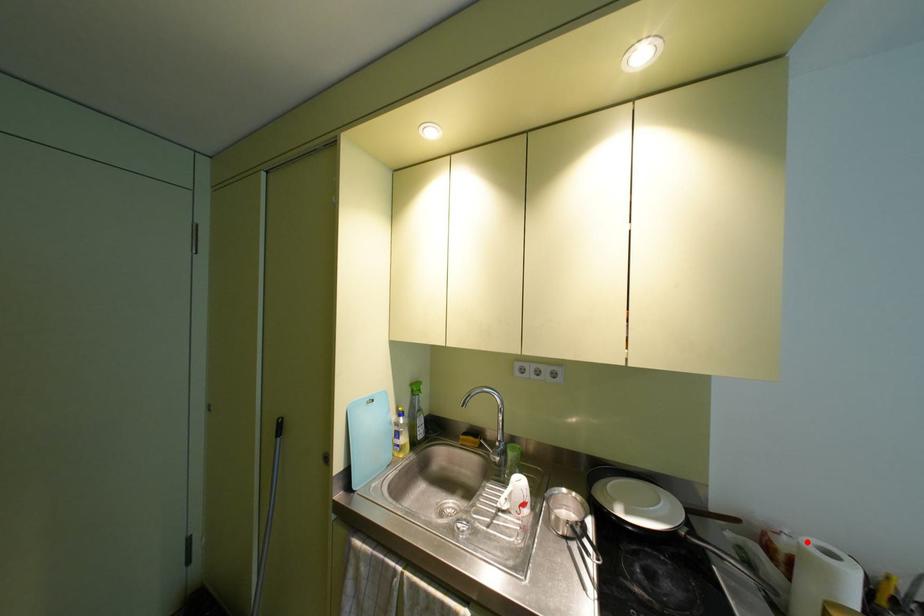
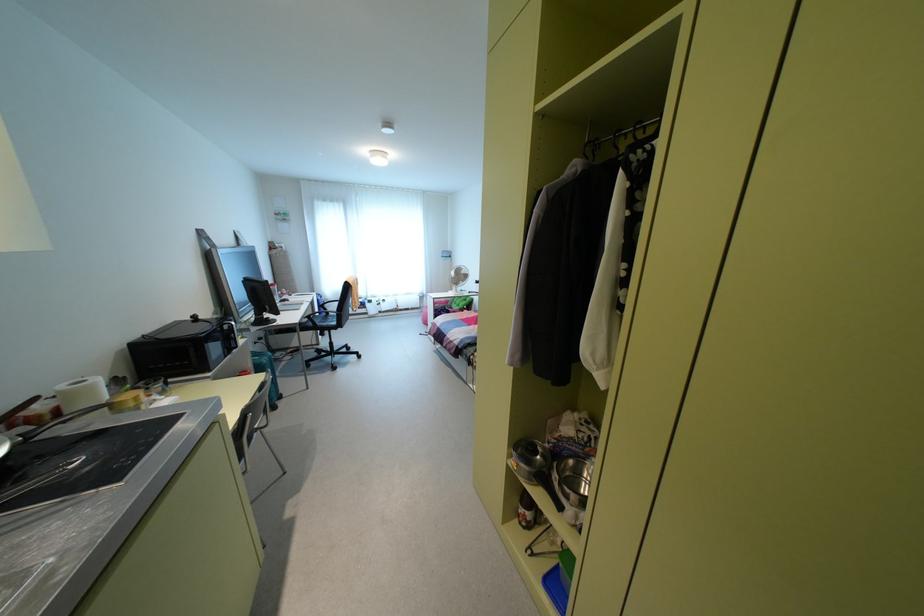
Locate, in the second image, the point that corresponds to the highlighted location in the first image.

(62, 387)